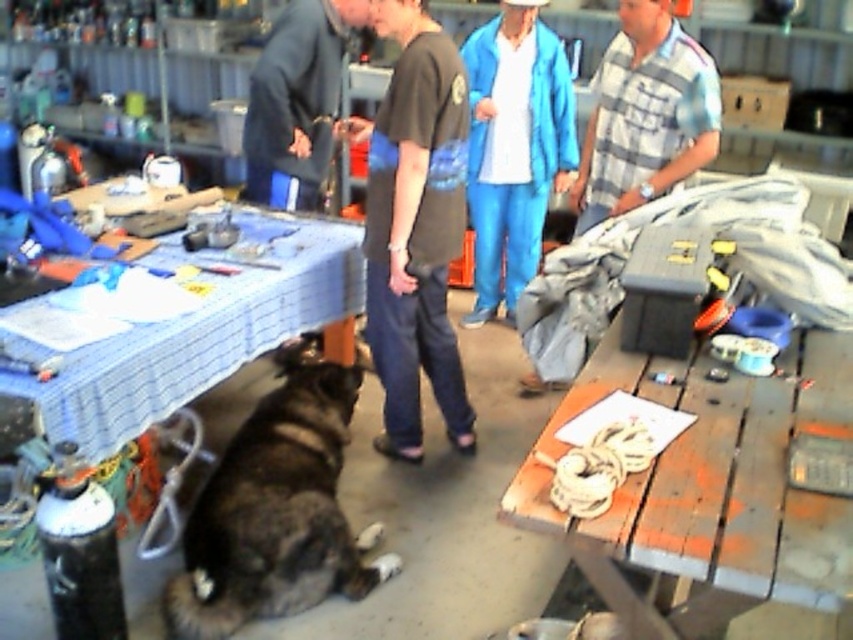
Question: Is dark brown fur dog at lower left above blue fabric pants at center?

Choices:
 (A) yes
 (B) no

Answer: (B)

Question: Can you confirm if dark brown fur dog at lower left is thinner than blue fabric table at lower left?

Choices:
 (A) yes
 (B) no

Answer: (A)

Question: Which of these objects is positioned closest to the dark blue fabric at center?

Choices:
 (A) blue fabric table at lower left
 (B) dark brown fur dog at lower left
 (C) blue fabric pants at center

Answer: (A)

Question: Does dark brown fur dog at lower left have a greater width compared to blue fabric pants at center?

Choices:
 (A) no
 (B) yes

Answer: (B)

Question: Which of the following is the farthest from the observer?

Choices:
 (A) (683, 68)
 (B) (793, 412)
 (C) (479, 253)

Answer: (C)

Question: Which object is the closest to the dark gray t-shirt at center?

Choices:
 (A) wooden table at lower right
 (B) dark blue fabric at center
 (C) blue fabric table at lower left

Answer: (C)